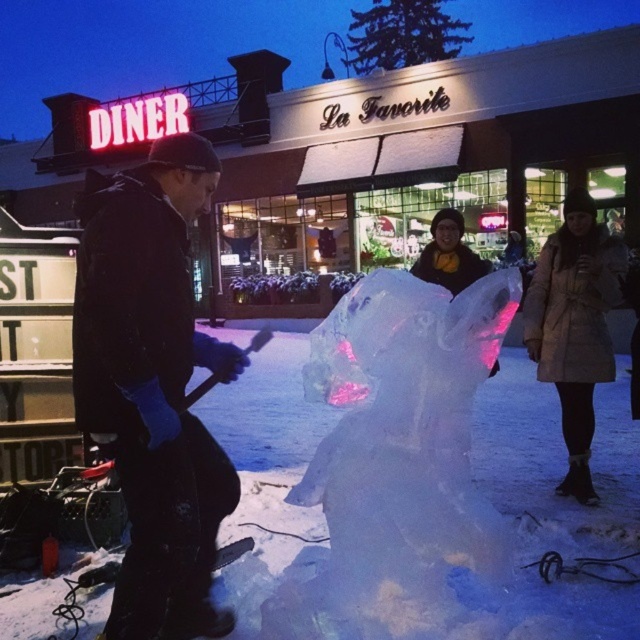
Question: Is black matte jacket at left thinner than beige down coat at right?

Choices:
 (A) no
 (B) yes

Answer: (A)

Question: Among these points, which one is farthest from the camera?

Choices:
 (A) (618, 280)
 (B) (131, 472)

Answer: (A)

Question: Does black matte jacket at left appear over beige down coat at right?

Choices:
 (A) yes
 (B) no

Answer: (B)

Question: Can you confirm if black matte jacket at left is wider than beige down coat at right?

Choices:
 (A) yes
 (B) no

Answer: (A)